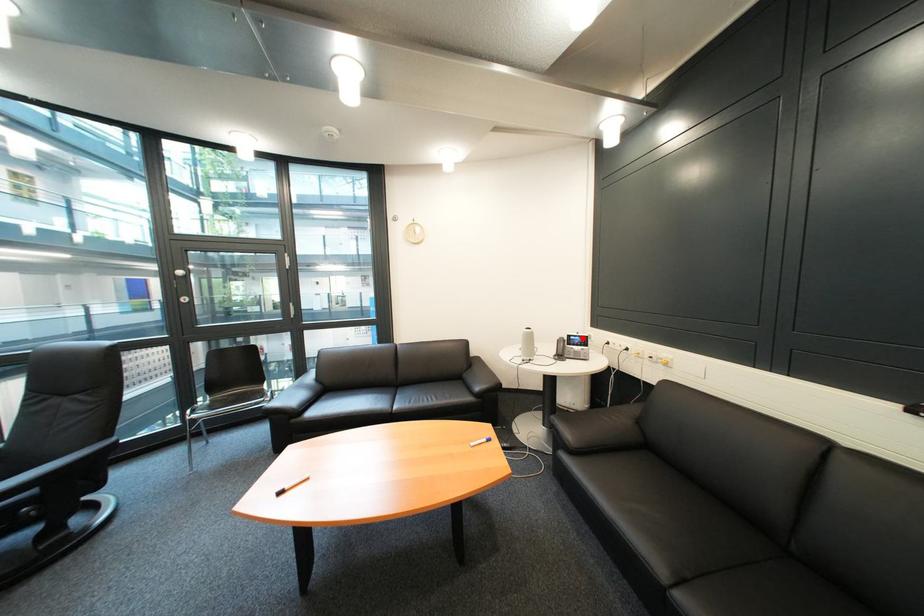
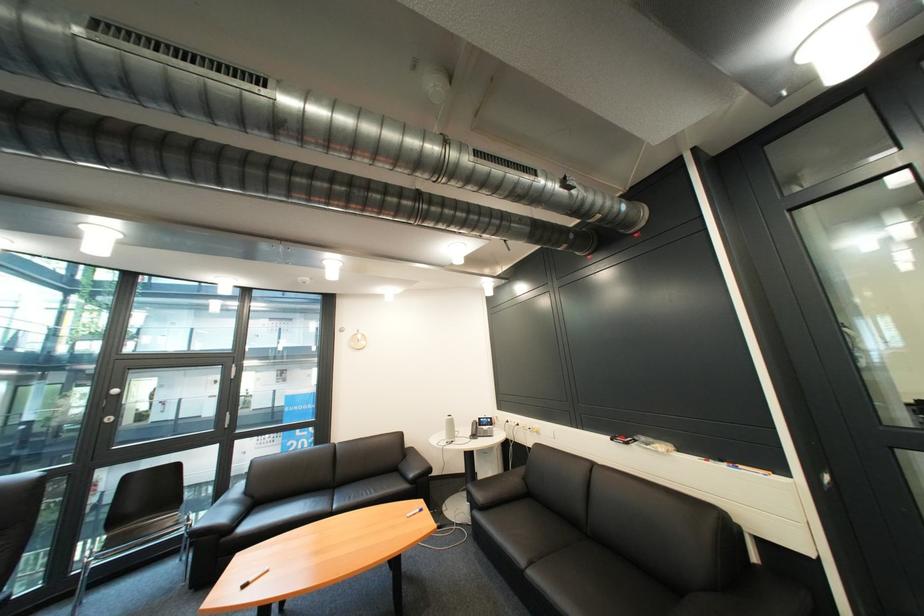
The point at the highlighted location is marked in the first image. Where is the corresponding point in the second image?

(492, 419)